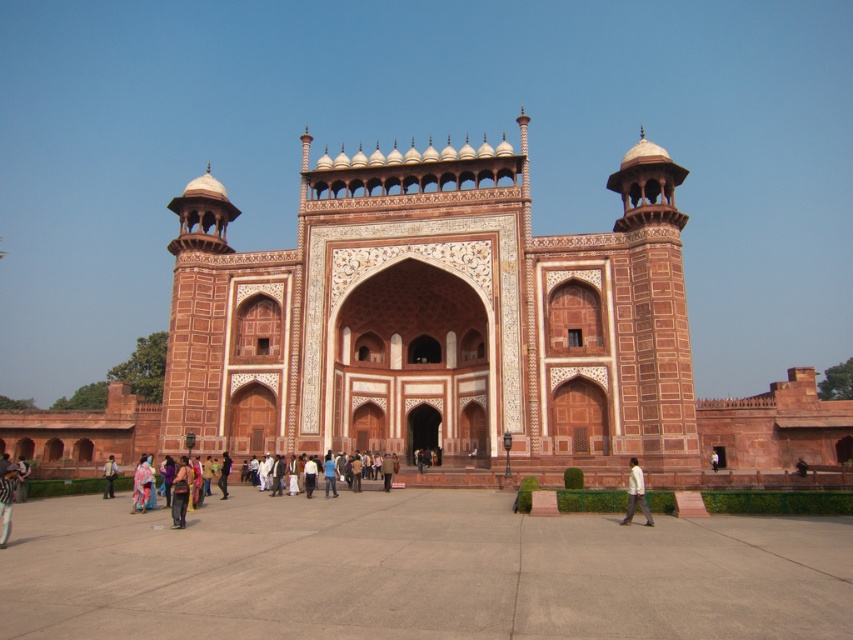
Question: Which point is farther to the camera?

Choices:
 (A) (x=630, y=502)
 (B) (x=381, y=260)
 (C) (x=102, y=497)

Answer: (B)

Question: Considering the real-world distances, which object is closest to the light brown fabric jacket at lower left?

Choices:
 (A) reddish-brown stone archway at center
 (B) dark brown leather pants at lower left
 (C) white matte shirt at lower right
 (D) multicolored fabric at center

Answer: (D)

Question: Is white matte shirt at lower right to the left of light brown fabric jacket at lower left from the viewer's perspective?

Choices:
 (A) no
 (B) yes

Answer: (A)

Question: Does dark brown leather pants at lower left appear on the right side of light brown fabric jacket at lower left?

Choices:
 (A) no
 (B) yes

Answer: (B)

Question: Is white matte shirt at lower right to the right of multicolored fabric at center from the viewer's perspective?

Choices:
 (A) no
 (B) yes

Answer: (B)

Question: Estimate the real-world distances between objects in this image. Which object is closer to the multicolored fabric at center?

Choices:
 (A) reddish-brown stone archway at center
 (B) light brown fabric jacket at lower left
 (C) white matte shirt at lower right
 (D) dark brown leather pants at lower left

Answer: (B)